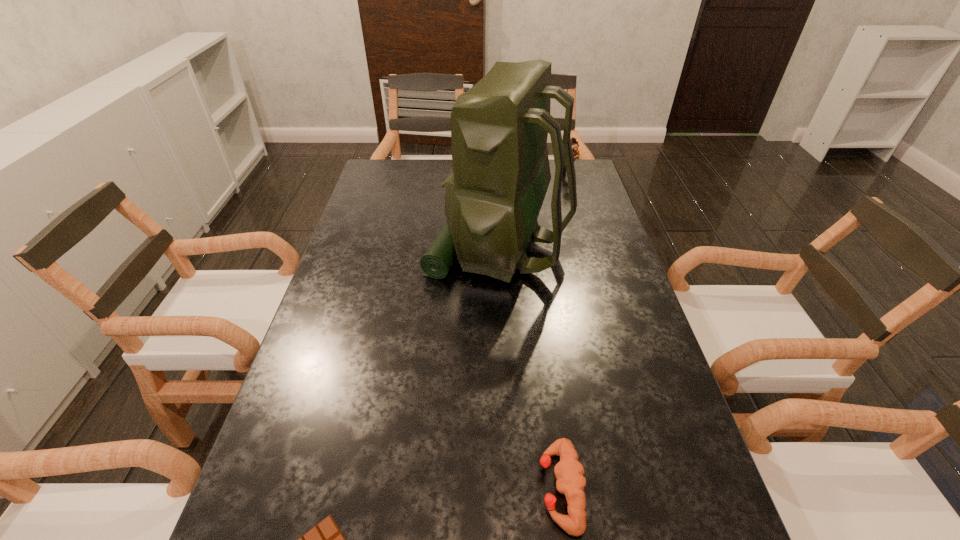
Where is `backpack`? The image size is (960, 540). backpack is located at coordinates (499, 128).

I want to click on the tallest object, so click(499, 128).

The height and width of the screenshot is (540, 960). I want to click on the farthest object, so click(x=575, y=145).

This screenshot has width=960, height=540. In order to click on the farther puncher in this screenshot , I will do `click(575, 145)`.

Find the location of `the third tallest object`. the third tallest object is located at coordinates (569, 472).

Find the location of `the shorter puncher`. the shorter puncher is located at coordinates (569, 472).

This screenshot has height=540, width=960. In order to click on free space located on the front of the backpack with visible pockets in this screenshot , I will do `click(354, 248)`.

At what (x,y) coordinates should I click in order to perform the action: click on free space located on the front of the backpack with visible pockets. Please return your answer as a coordinate pair (x, y). This screenshot has height=540, width=960. Looking at the image, I should click on (365, 248).

Locate an element on the screen. vacant space located on the front of the backpack with visible pockets is located at coordinates (354, 248).

Where is `free region located on the front-facing side of the farther puncher`? free region located on the front-facing side of the farther puncher is located at coordinates (473, 173).